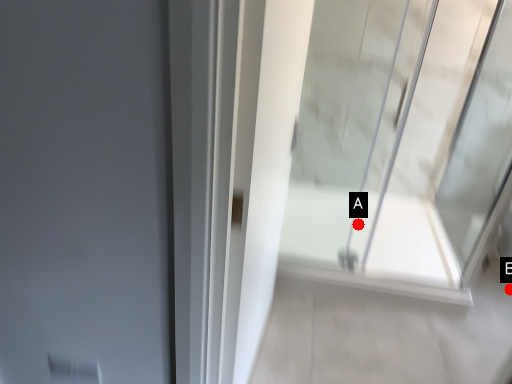
Question: Two points are circled on the image, labeled by A and B beside each circle. Which point is closer to the camera?

Choices:
 (A) A is closer
 (B) B is closer

Answer: (B)